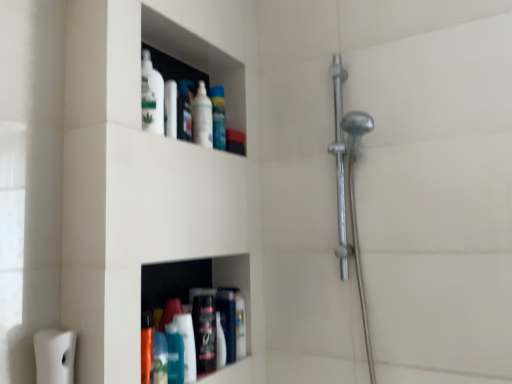
Question: Is blue glossy mouthwash at lower center, positioned as the first mouthwash in bottom-to-top order, facing towards matte black bottle at lower center, which is the 1th toiletry in right-to-left order?

Choices:
 (A) yes
 (B) no

Answer: (B)

Question: Could matte black bottle at lower center, which is the 1th toiletry in right-to-left order, be considered to be inside blue glossy mouthwash at lower center, placed as the 2th mouthwash when sorted from right to left?

Choices:
 (A) yes
 (B) no

Answer: (B)

Question: Is blue glossy mouthwash at lower center, marked as the second mouthwash in a back-to-front arrangement, positioned in front of matte black bottle at lower center, which is the 1th toiletry in right-to-left order?

Choices:
 (A) yes
 (B) no

Answer: (A)

Question: From a real-world perspective, is blue glossy mouthwash at lower center, marked as the second mouthwash in a back-to-front arrangement, beneath matte black bottle at lower center, which is the 1th toiletry in right-to-left order?

Choices:
 (A) no
 (B) yes

Answer: (B)

Question: Is blue glossy mouthwash at lower center, marked as the second mouthwash in a back-to-front arrangement, facing away from matte black bottle at lower center, which is the 1th toiletry in right-to-left order?

Choices:
 (A) yes
 (B) no

Answer: (B)

Question: Does blue glossy mouthwash at lower center, marked as the second mouthwash in a back-to-front arrangement, have a smaller size compared to matte black bottle at lower center, marked as the 2th toiletry in a left-to-right arrangement?

Choices:
 (A) no
 (B) yes

Answer: (B)

Question: Is blue glossy mouthwash at lower center, the 1th mouthwash when ordered from left to right, far from matte plastic container at upper center, the second toiletry viewed from the right?

Choices:
 (A) yes
 (B) no

Answer: (B)

Question: Does blue glossy mouthwash at lower center, marked as the second mouthwash in a back-to-front arrangement, have a lesser width compared to matte plastic container at upper center, the second toiletry viewed from the right?

Choices:
 (A) yes
 (B) no

Answer: (B)

Question: From the image's perspective, is blue glossy mouthwash at lower center, marked as the second mouthwash in a top-to-bottom arrangement, on top of matte plastic container at upper center, placed as the 1th toiletry when sorted from left to right?

Choices:
 (A) no
 (B) yes

Answer: (A)

Question: Is blue glossy mouthwash at lower center, positioned as the first mouthwash in bottom-to-top order, wider than matte plastic container at upper center, the second toiletry viewed from the right?

Choices:
 (A) no
 (B) yes

Answer: (B)

Question: Is matte plastic container at upper center, which appears as the 1th toiletry when viewed from the top, inside blue glossy mouthwash at lower center, placed as the 2th mouthwash when sorted from right to left?

Choices:
 (A) yes
 (B) no

Answer: (B)

Question: Is blue glossy mouthwash at lower center, placed as the 2th mouthwash when sorted from right to left, taller than matte plastic container at upper center, placed as the 1th toiletry when sorted from left to right?

Choices:
 (A) no
 (B) yes

Answer: (A)

Question: Is polished chrome shower at right outside white matte toilet paper at lower left?

Choices:
 (A) yes
 (B) no

Answer: (A)